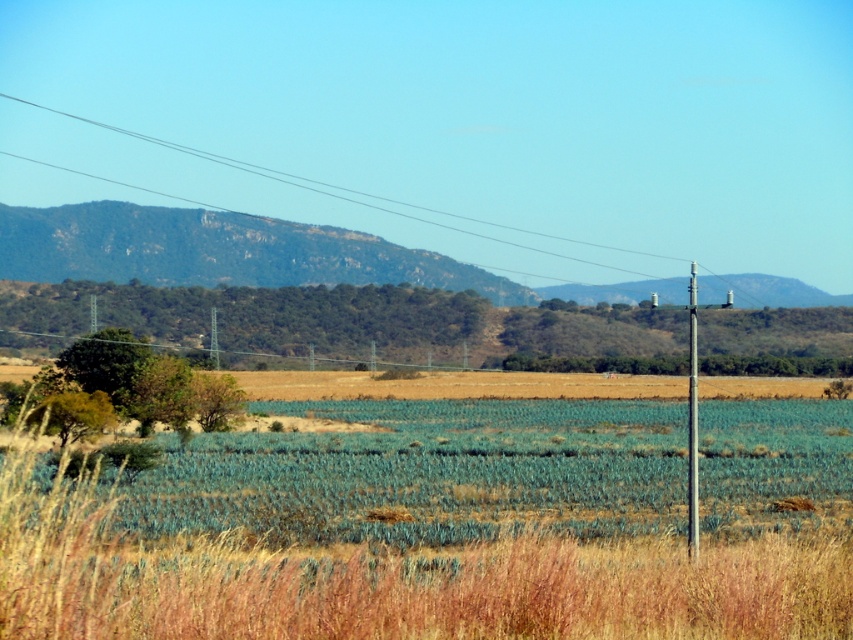
You are a farmer assessing the land. You notice the dry grass at lower center and the metallic gray telegraph pole at right. Which of these two objects takes up more visual space in the scene?

The metallic gray telegraph pole at right occupies more visual space than the dry grass at lower center according to the description provided.

You are a hiker planning to take a photo of the green rocky mountain at upper center and the metallic gray telegraph pole at right from a position where both are visible in the frame. Based on their heights, which object will appear taller in your photo?

The metallic gray telegraph pole at right will appear taller in the photo because the green rocky mountain at upper center is not as tall as it.

You are standing in the rural landscape and want to take a photo. You notice two points in the scene labeled as point (815, 476) and point (45, 269). Which point should you focus on to ensure it appears clearer in your photo?

Point (815, 476) is closer to the camera than point (45, 269), so focusing on point (815, 476) will ensure it appears clearer in the photo.